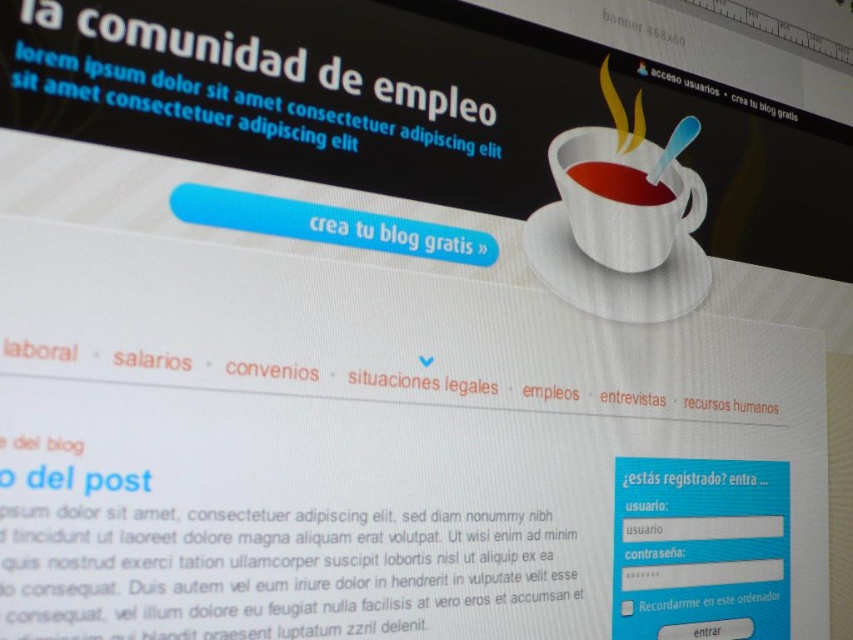
Does matte white cup at upper right appear on the left side of matte ceramic cup at upper right?

Incorrect, matte white cup at upper right is not on the left side of matte ceramic cup at upper right.

Which of these two, matte white cup at upper right or matte ceramic cup at upper right, stands taller?

matte white cup at upper right

Measure the distance between matte white cup at upper right and camera.

The distance of matte white cup at upper right from camera is 36.39 inches.

In order to click on matte white cup at upper right in this screenshot , I will do `click(624, 202)`.